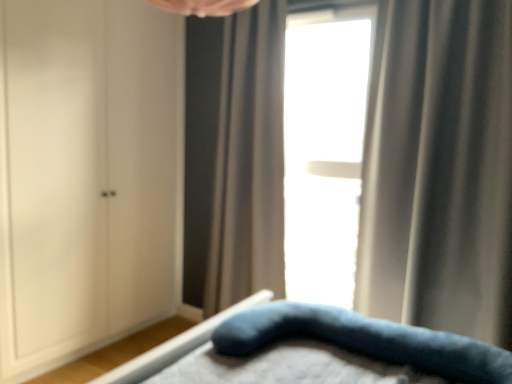
Question: Is the depth of gray textured curtain at center, the first curtain viewed from the left, greater than that of transparent glass window at center?

Choices:
 (A) yes
 (B) no

Answer: (B)

Question: Considering the relative positions of gray textured curtain at center, which is counted as the 2th curtain, starting from the right, and transparent glass window at center in the image provided, is gray textured curtain at center, which is counted as the 2th curtain, starting from the right, to the right of transparent glass window at center from the viewer's perspective?

Choices:
 (A) no
 (B) yes

Answer: (A)

Question: From a real-world perspective, is gray textured curtain at center, which is counted as the 2th curtain, starting from the right, positioned over transparent glass window at center based on gravity?

Choices:
 (A) yes
 (B) no

Answer: (B)

Question: From the image's perspective, would you say gray textured curtain at center, the first curtain when ordered from back to front, is shown under transparent glass window at center?

Choices:
 (A) no
 (B) yes

Answer: (B)

Question: Does gray textured curtain at center, the first curtain viewed from the left, come in front of transparent glass window at center?

Choices:
 (A) no
 (B) yes

Answer: (B)

Question: Considering the positions of silky gray curtain at right, the 2th curtain from the back, and velvety blue pillow at lower center in the image, is silky gray curtain at right, the 2th curtain from the back, wider or thinner than velvety blue pillow at lower center?

Choices:
 (A) thin
 (B) wide

Answer: (A)

Question: Is silky gray curtain at right, placed as the first curtain when sorted from front to back, taller or shorter than velvety blue pillow at lower center?

Choices:
 (A) tall
 (B) short

Answer: (A)

Question: From a real-world perspective, is silky gray curtain at right, placed as the first curtain when sorted from front to back, positioned above or below velvety blue pillow at lower center?

Choices:
 (A) below
 (B) above

Answer: (B)

Question: From the image's perspective, relative to velvety blue pillow at lower center, is silky gray curtain at right, the 2th curtain from the back, above or below?

Choices:
 (A) below
 (B) above

Answer: (B)

Question: Looking at the image, does gray textured curtain at center, the first curtain when ordered from back to front, seem bigger or smaller compared to silky gray curtain at right, placed as the second curtain when sorted from left to right?

Choices:
 (A) big
 (B) small

Answer: (B)

Question: In the image, is gray textured curtain at center, which is counted as the 2th curtain, starting from the right, on the left side or the right side of silky gray curtain at right, placed as the first curtain when sorted from front to back?

Choices:
 (A) right
 (B) left

Answer: (B)

Question: Do you think gray textured curtain at center, which is counted as the 2th curtain, starting from the right, is within silky gray curtain at right, placed as the first curtain when sorted from front to back, or outside of it?

Choices:
 (A) outside
 (B) inside

Answer: (A)

Question: From the image's perspective, is gray textured curtain at center, arranged as the 2th curtain when viewed from the front, above or below silky gray curtain at right, the 2th curtain from the back?

Choices:
 (A) above
 (B) below

Answer: (B)

Question: Looking at the image, does white matte cabinet at left seem bigger or smaller compared to transparent glass window at center?

Choices:
 (A) big
 (B) small

Answer: (A)

Question: Do you think white matte cabinet at left is within transparent glass window at center, or outside of it?

Choices:
 (A) outside
 (B) inside

Answer: (A)